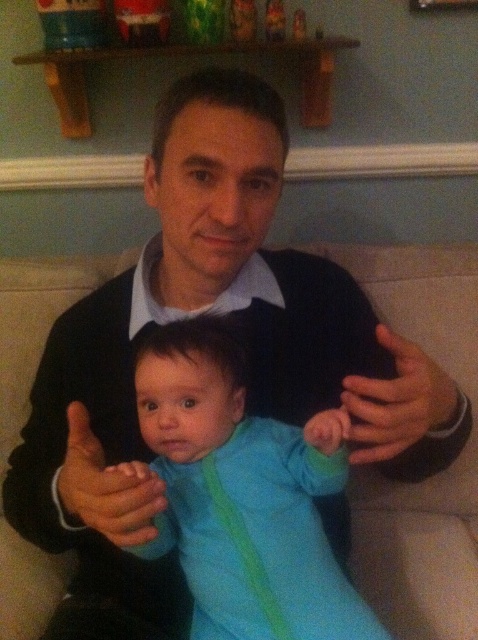
Question: Which point is farther to the camera?

Choices:
 (A) blue fleece onesie at center
 (B) blue fabric hand at center

Answer: (A)

Question: Which point is farther from the camera taking this photo?

Choices:
 (A) (311, 596)
 (B) (128, 467)

Answer: (A)

Question: Which of the following is the closest to the observer?

Choices:
 (A) (280, 595)
 (B) (122, 504)

Answer: (B)

Question: Does blue fleece onesie at center appear on the right side of blue fabric hand at center?

Choices:
 (A) yes
 (B) no

Answer: (A)

Question: Can you confirm if blue fleece onesie at center is positioned below blue fabric hand at center?

Choices:
 (A) no
 (B) yes

Answer: (B)

Question: Considering the relative positions of blue fleece onesie at center and blue fabric hand at center in the image provided, where is blue fleece onesie at center located with respect to blue fabric hand at center?

Choices:
 (A) below
 (B) above

Answer: (A)